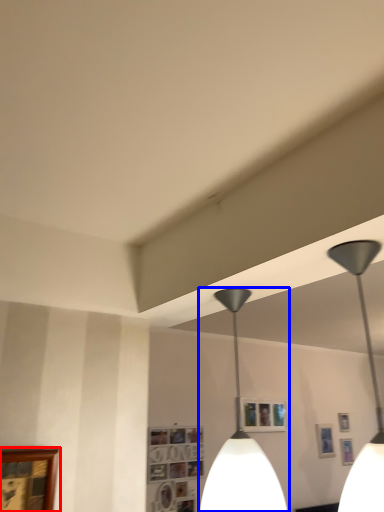
Question: Which of the following is the farthest to the observer, picture frame (highlighted by a red box) or lamp (highlighted by a blue box)?

Choices:
 (A) picture frame
 (B) lamp

Answer: (A)